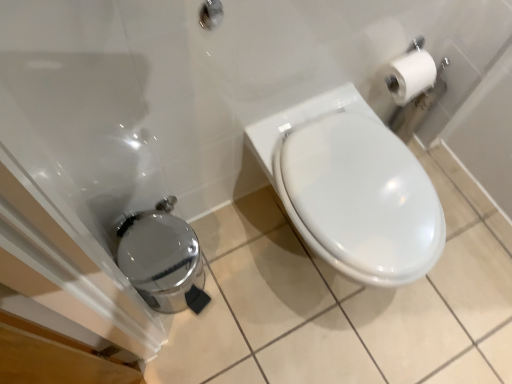
The image size is (512, 384). Identify the location of free space above polished stainless steel trash can at lower left (from a real-world perspective). (174, 251).